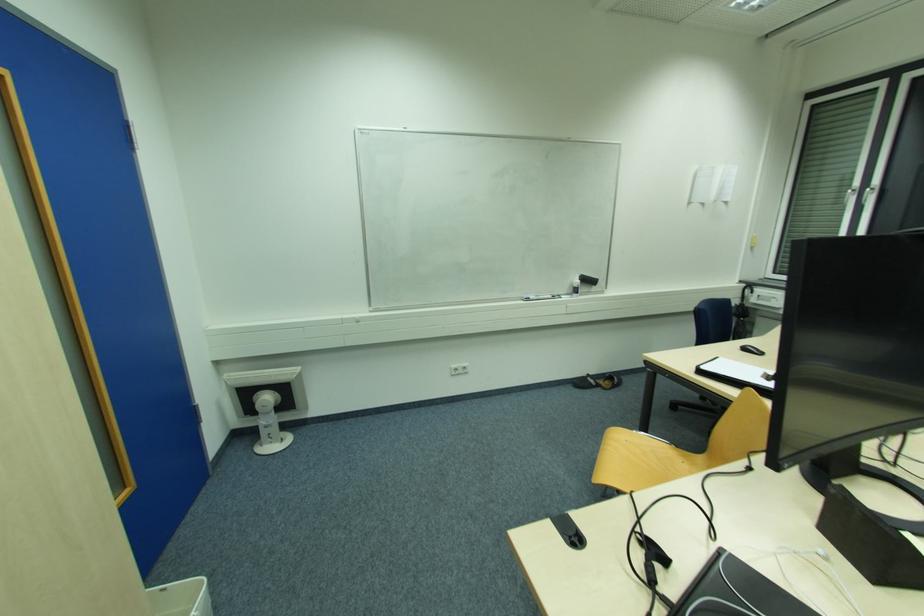
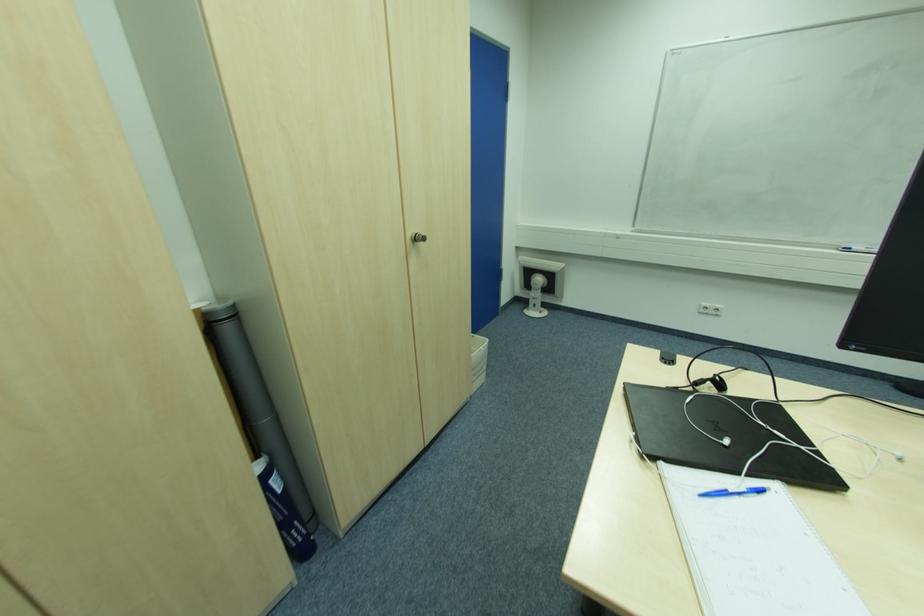
In the second image, find the point that corresponds to pixel 269 428 in the first image.

(536, 300)